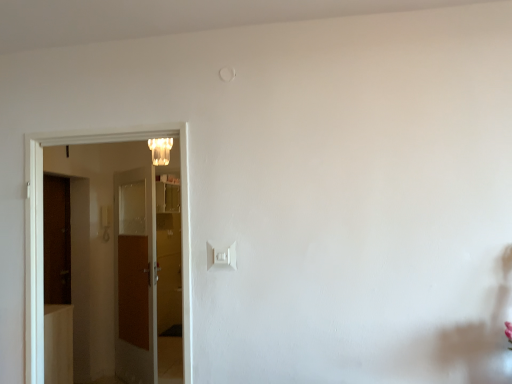
Question: Can you confirm if brown wooden door at left, the 1th door from the back, is bigger than white plastic light switch at center?

Choices:
 (A) yes
 (B) no

Answer: (A)

Question: Is brown wooden door at left, which is counted as the 2th door, starting from the front, placed right next to white plastic light switch at center?

Choices:
 (A) yes
 (B) no

Answer: (B)

Question: Is brown wooden door at left, the 1th door from the back, to the right of white plastic light switch at center from the viewer's perspective?

Choices:
 (A) no
 (B) yes

Answer: (A)

Question: Is brown wooden door at left, which is counted as the 2th door, starting from the front, oriented away from white plastic light switch at center?

Choices:
 (A) no
 (B) yes

Answer: (A)

Question: Is brown wooden door at left, the 1th door from the back, wider than white plastic light switch at center?

Choices:
 (A) no
 (B) yes

Answer: (B)

Question: Choose the correct answer: Is white plastic light switch at center inside translucent glass chandelier at upper center or outside it?

Choices:
 (A) inside
 (B) outside

Answer: (B)

Question: Relative to translucent glass chandelier at upper center, is white plastic light switch at center in front or behind?

Choices:
 (A) front
 (B) behind

Answer: (A)

Question: Considering the relative positions of white plastic light switch at center and translucent glass chandelier at upper center in the image provided, is white plastic light switch at center to the left or to the right of translucent glass chandelier at upper center?

Choices:
 (A) right
 (B) left

Answer: (A)

Question: Considering the positions of point (232, 256) and point (165, 142), is point (232, 256) closer or farther from the camera than point (165, 142)?

Choices:
 (A) closer
 (B) farther

Answer: (A)

Question: From the image's perspective, is translucent glass chandelier at upper center located above or below brown wooden door at left, the 1th door from the back?

Choices:
 (A) above
 (B) below

Answer: (A)

Question: Based on their sizes in the image, would you say translucent glass chandelier at upper center is bigger or smaller than brown wooden door at left, the 1th door from the back?

Choices:
 (A) big
 (B) small

Answer: (B)

Question: In the image, is translucent glass chandelier at upper center on the left side or the right side of brown wooden door at left, the 1th door from the back?

Choices:
 (A) left
 (B) right

Answer: (B)

Question: In the image, is translucent glass chandelier at upper center positioned in front of or behind brown wooden door at left, which is counted as the 2th door, starting from the front?

Choices:
 (A) behind
 (B) front

Answer: (B)

Question: From the image's perspective, relative to white plastic light switch at center, is translucent glass chandelier at upper center above or below?

Choices:
 (A) below
 (B) above

Answer: (B)

Question: Based on their positions, is translucent glass chandelier at upper center located to the left or right of white plastic light switch at center?

Choices:
 (A) left
 (B) right

Answer: (A)